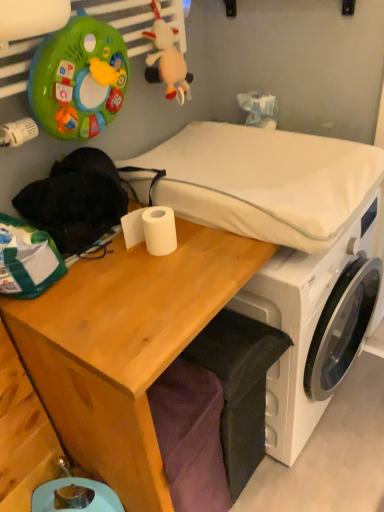
I want to click on white fabric mattress at center, so click(x=265, y=182).

This screenshot has width=384, height=512. I want to click on white plastic washing machine at center, so click(x=286, y=248).

You are a GUI agent. You are given a task and a screenshot of the screen. Output one action in this format:
    pyautogui.click(x=<x>, y=<y>)
    Task: Click on the wooden desk at center
    
    Given the screenshot: What is the action you would take?
    125,346

Is white fabric mattress at center positioned with its back to wooden desk at center?

No, wooden desk at center is not at the back of white fabric mattress at center.

Based on the photo, can you confirm if white fabric mattress at center is shorter than wooden desk at center?

Indeed, white fabric mattress at center has a lesser height compared to wooden desk at center.

Where is `desk that is under the white fabric mattress at center (from a real-world perspective)`? The width and height of the screenshot is (384, 512). desk that is under the white fabric mattress at center (from a real-world perspective) is located at coordinates (125, 346).

From the image's perspective, is white fabric mattress at center on wooden desk at center?

Indeed, from the image's perspective, white fabric mattress at center is shown above wooden desk at center.

Visually, is white fabric mattress at center positioned to the left or to the right of white matte toilet paper at center?

From the image, it's evident that white fabric mattress at center is to the right of white matte toilet paper at center.

From the image's perspective, which is below, white fabric mattress at center or white matte toilet paper at center?

white matte toilet paper at center is shown below in the image.

Could you tell me if white fabric mattress at center is turned towards white matte toilet paper at center?

No.

Considering the relative sizes of white fabric mattress at center and white matte toilet paper at center in the image provided, is white fabric mattress at center thinner than white matte toilet paper at center?

No, white fabric mattress at center is not thinner than white matte toilet paper at center.

The image size is (384, 512). In order to click on mattress located above the wooden desk at center (from a real-world perspective) in this screenshot , I will do `click(265, 182)`.

How different are the orientations of wooden desk at center and white fabric mattress at center in degrees?

They differ by 0.789 degrees in their facing directions.

From the image's perspective, is wooden desk at center on white fabric mattress at center?

No, from the image's perspective, wooden desk at center is not on top of white fabric mattress at center.

Is wooden desk at center wider or thinner than white fabric mattress at center?

wooden desk at center is thinner than white fabric mattress at center.

At what (x,y) coordinates should I click in order to perform the action: click on desk below the white plastic washing machine at center (from the image's perspective). Please return your answer as a coordinate pair (x, y). Looking at the image, I should click on (x=125, y=346).

Considering the relative sizes of wooden desk at center and white plastic washing machine at center in the image provided, is wooden desk at center taller than white plastic washing machine at center?

Indeed, wooden desk at center has a greater height compared to white plastic washing machine at center.

Which is behind, wooden desk at center or white plastic washing machine at center?

white plastic washing machine at center is further away from the camera.

Would you say white plastic washing machine at center is part of wooden desk at center's contents?

Yes, white plastic washing machine at center can be found within wooden desk at center.

Who is smaller, white plastic washing machine at center or white matte toilet paper at center?

white matte toilet paper at center is smaller.

From the image's perspective, which is above, white plastic washing machine at center or white matte toilet paper at center?

white matte toilet paper at center.

Is white plastic washing machine at center inside or outside of white matte toilet paper at center?

white plastic washing machine at center is not inside white matte toilet paper at center, it's outside.

Is white plastic washing machine at center next to white matte toilet paper at center and touching it?

white plastic washing machine at center and white matte toilet paper at center are clearly separated.

From the image's perspective, which one is positioned higher, white plastic washing machine at center or wooden desk at center?

white plastic washing machine at center appears higher in the image.

Looking at this image, from a real-world perspective, who is located higher, white plastic washing machine at center or wooden desk at center?

In real-world perspective, wooden desk at center is above.

Considering the relative sizes of white plastic washing machine at center and wooden desk at center in the image provided, is white plastic washing machine at center bigger than wooden desk at center?

No, white plastic washing machine at center is not bigger than wooden desk at center.

Looking at the image, does white matte toilet paper at center seem bigger or smaller compared to white fabric mattress at center?

In the image, white matte toilet paper at center appears to be smaller than white fabric mattress at center.

Looking at this image, is white matte toilet paper at center looking in the opposite direction of white fabric mattress at center?

No, white matte toilet paper at center is not facing away from white fabric mattress at center.

Would you say white matte toilet paper at center is a long distance from white fabric mattress at center?

Actually, white matte toilet paper at center and white fabric mattress at center are a little close together.

This screenshot has width=384, height=512. Identify the location of mattress above the wooden desk at center (from a real-world perspective). (265, 182).

Where is `mattress above the white matte toilet paper at center (from the image's perspective)`? mattress above the white matte toilet paper at center (from the image's perspective) is located at coordinates (265, 182).

Estimate the real-world distances between objects in this image. Which object is closer to white matte toilet paper at center, wooden desk at center or white plastic washing machine at center?

Among the two, wooden desk at center is located nearer to white matte toilet paper at center.

Which object lies further to the anchor point white fabric mattress at center, white matte toilet paper at center or wooden desk at center?

wooden desk at center.

Estimate the real-world distances between objects in this image. Which object is further from wooden desk at center, white matte toilet paper at center or white plastic washing machine at center?

white plastic washing machine at center is further to wooden desk at center.

Estimate the real-world distances between objects in this image. Which object is further from white matte toilet paper at center, white plastic washing machine at center or white fabric mattress at center?

white plastic washing machine at center.

Based on their spatial positions, is wooden desk at center or white fabric mattress at center closer to white plastic washing machine at center?

white fabric mattress at center is positioned closer to the anchor white plastic washing machine at center.

Looking at the image, which one is located further to wooden desk at center, white plastic washing machine at center or white matte toilet paper at center?

Among the two, white plastic washing machine at center is located further to wooden desk at center.

From the image, which object appears to be farther from white fabric mattress at center, wooden desk at center or white plastic washing machine at center?

wooden desk at center is further to white fabric mattress at center.

Based on their spatial positions, is white fabric mattress at center or white plastic washing machine at center further from white matte toilet paper at center?

The object further to white matte toilet paper at center is white plastic washing machine at center.

Identify the location of toilet paper between white fabric mattress at center and wooden desk at center in the up-down direction. (151, 229).

Find the location of `desk situated between white matte toilet paper at center and white plastic washing machine at center from left to right`. desk situated between white matte toilet paper at center and white plastic washing machine at center from left to right is located at coordinates (125, 346).

Identify the location of toilet paper that lies between white fabric mattress at center and white plastic washing machine at center from top to bottom. (151, 229).

This screenshot has height=512, width=384. I want to click on machine between white fabric mattress at center and wooden desk at center in the up-down direction, so click(x=286, y=248).